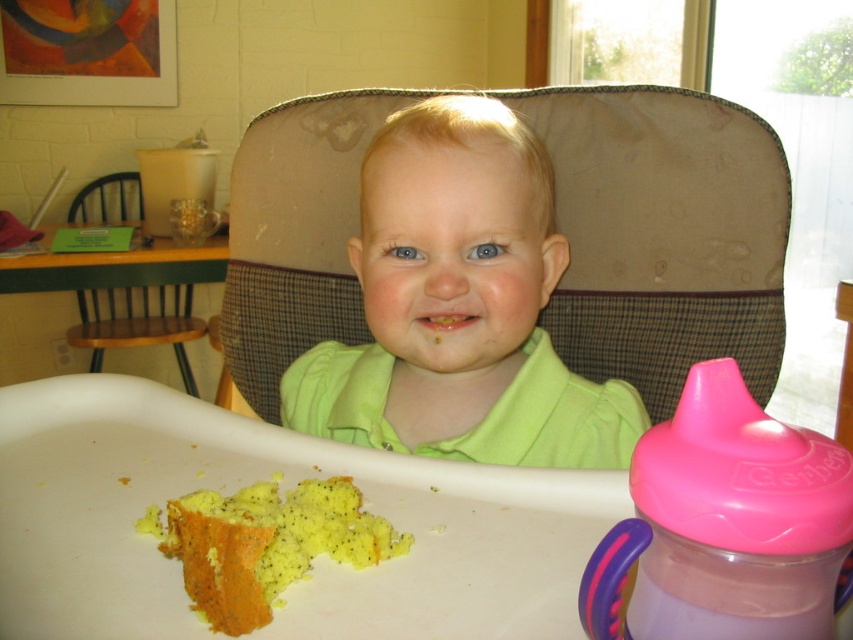
You are a photographer taking a picture of the child in the high chair. The pink plastic sippy cup at right is in the frame. To ensure the sippy cup is in focus, you need to know its distance from the camera. Can you determine if it is within the 10 inches focus range of your lens?

The pink plastic sippy cup at right is 10.92 inches away from camera, so it is slightly beyond the 10 inches focus range of your lens.

You are a parent trying to reach the yellow crumbly cake at lower left from your current position. Based on the scene, is it possible to grab it without moving your chair?

The yellow crumbly cake at lower left is 16.15 inches from viewer, so it is within reach if you can extend your arm that far without moving your chair.

You are a photographer trying to capture the perfect shot of the child in the high chair. You notice two points in the scene marked as point 1 at coordinates (691, 451) and point 2 at coordinates (260, 500). Which point should you focus on to ensure the subject is sharp in your photo?

You should focus on point 1 at coordinates (691, 451) because it is closer to the camera than point 2 at coordinates (260, 500), ensuring the subject remains sharp.